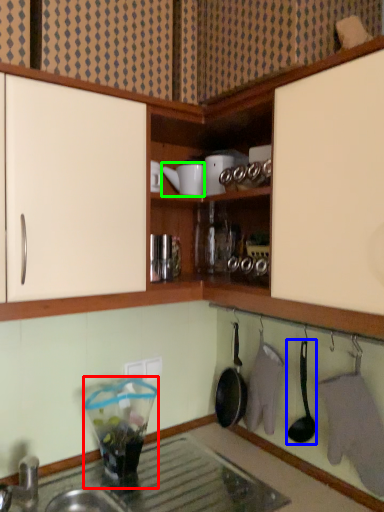
Question: Which object is positioned closest to appliance (highlighted by a red box)? Select from spoon (highlighted by a blue box) and appliance (highlighted by a green box).

Choices:
 (A) spoon
 (B) appliance

Answer: (A)